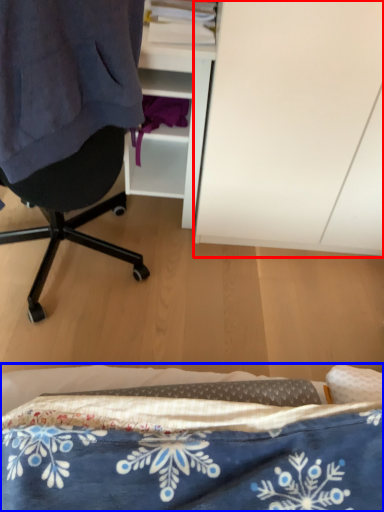
Question: Which of the following is the farthest to the observer, cabinetry (highlighted by a red box) or bed (highlighted by a blue box)?

Choices:
 (A) cabinetry
 (B) bed

Answer: (A)